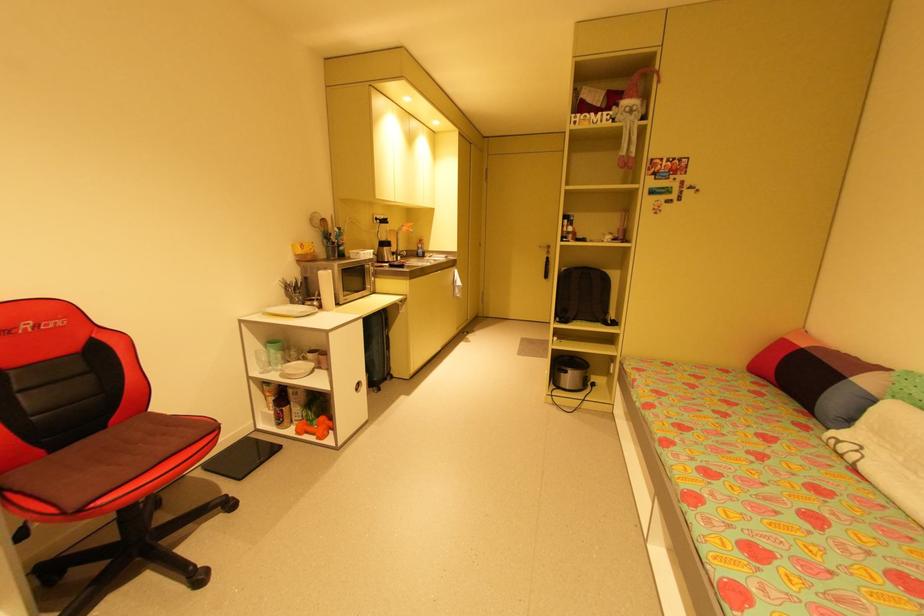
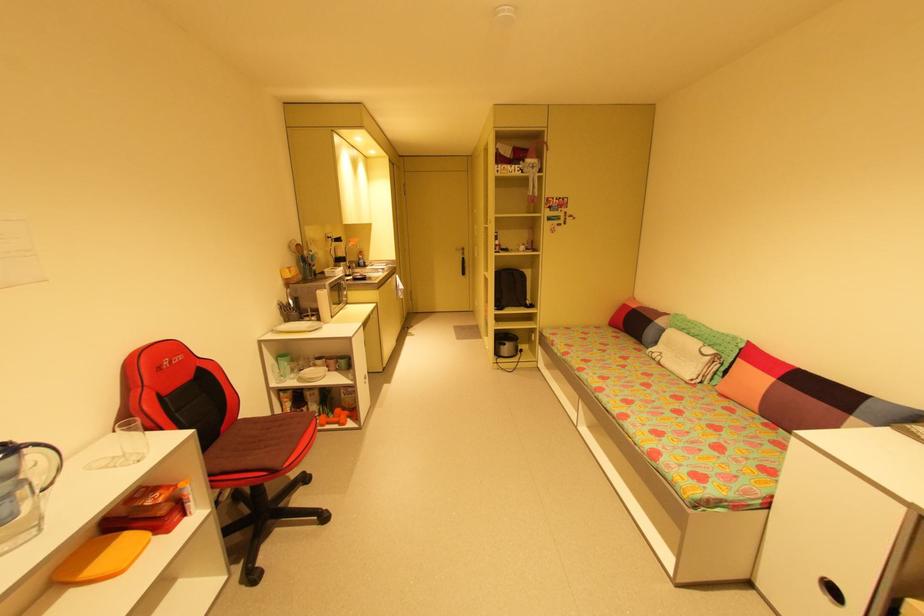
Where in the second image is the point corresponding to point 276,352 from the first image?

(290, 363)